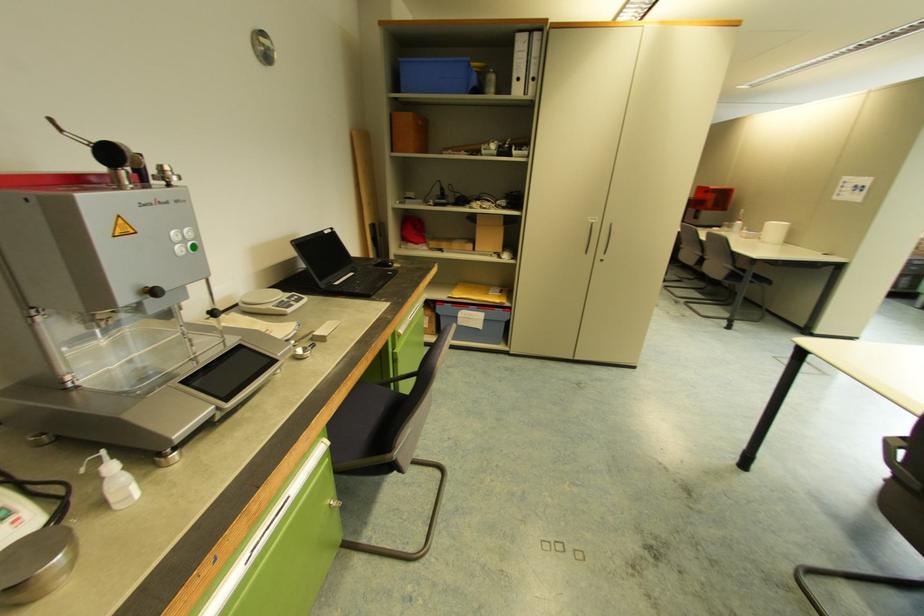
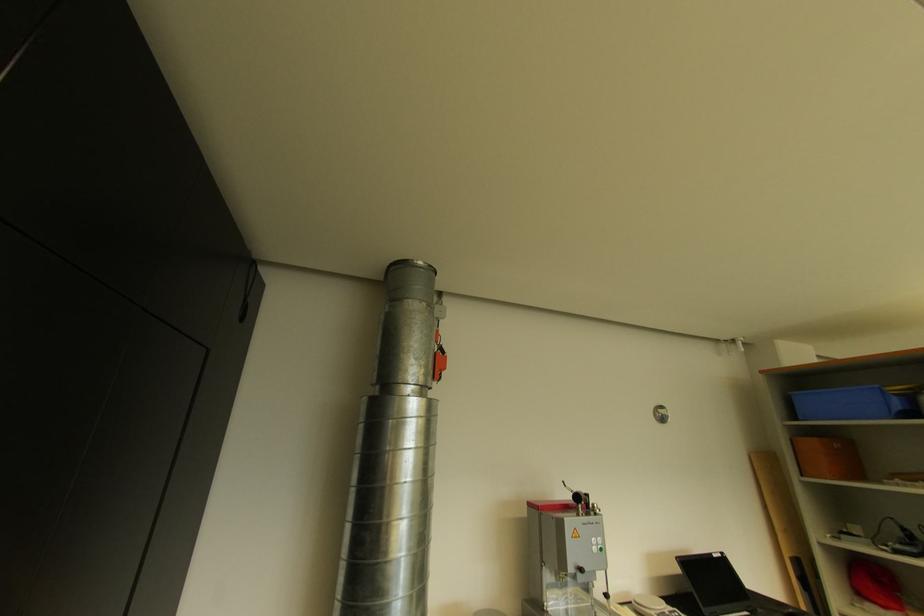
The images are taken continuously from a first-person perspective. In which direction is your viewpoint rotating?

The camera rotated toward left-up.